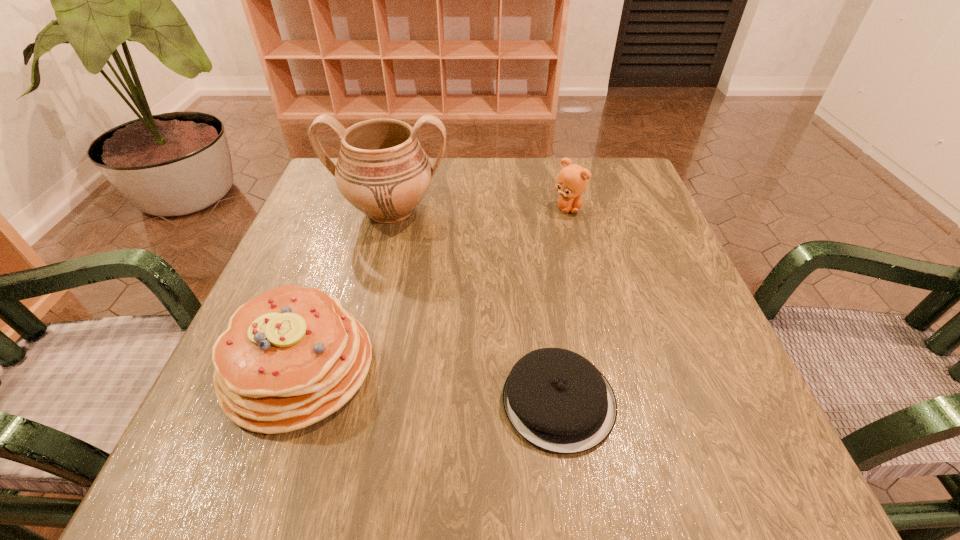
In order to click on vacant region at the near right corner of the desktop in this screenshot , I will do `click(662, 441)`.

What are the coordinates of `unoccupied position between the teddy bear and the taller pancake` in the screenshot? It's located at (433, 288).

Identify the location of free area in between the urn and the right pancake. (474, 306).

I want to click on vacant region between the left pancake and the teddy bear, so click(433, 288).

Identify the location of vacant point located between the taller pancake and the urn. Image resolution: width=960 pixels, height=540 pixels. (345, 289).

Where is `unoccupied area between the tallest object and the left pancake`? unoccupied area between the tallest object and the left pancake is located at coordinates (345, 289).

In order to click on vacant point located between the tallest object and the teddy bear in this screenshot , I will do `click(479, 209)`.

Image resolution: width=960 pixels, height=540 pixels. Find the location of `free space that is in between the urn and the teddy bear`. free space that is in between the urn and the teddy bear is located at coordinates [x=479, y=209].

The width and height of the screenshot is (960, 540). I want to click on empty space between the urn and the shorter pancake, so click(474, 306).

You are a GUI agent. You are given a task and a screenshot of the screen. Output one action in this format:
    pyautogui.click(x=<x>, y=<y>)
    Task: Click on the vacant space that's between the tallest object and the taller pancake
    
    Given the screenshot: What is the action you would take?
    pyautogui.click(x=345, y=289)